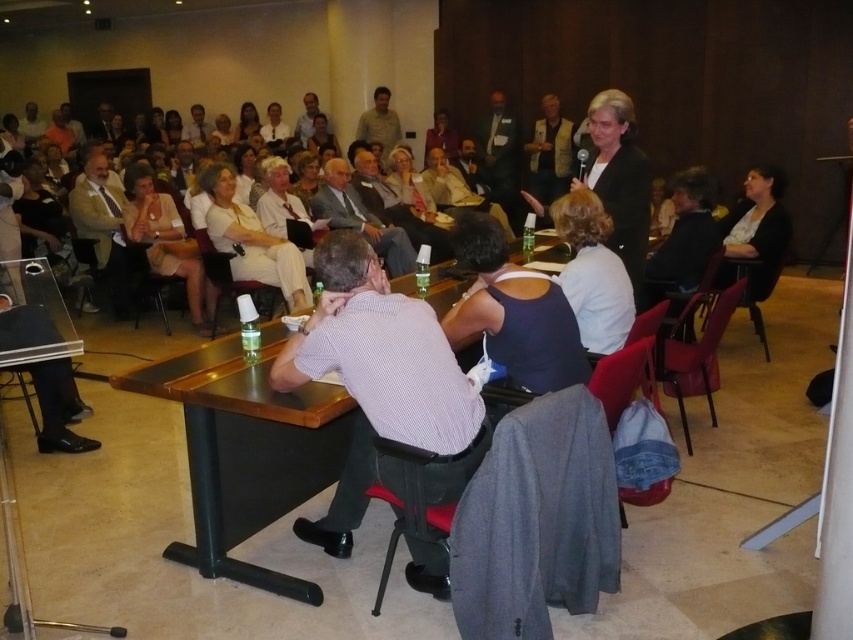
Which is more to the right, white striped shirt at center or dark blue tank top at center?

From the viewer's perspective, dark blue tank top at center appears more on the right side.

I want to click on white striped shirt at center, so click(x=381, y=385).

Locate an element on the screen. This screenshot has height=640, width=853. white striped shirt at center is located at coordinates (381, 385).

Does wooden table at center have a larger size compared to matte white blouse at center?

Correct, wooden table at center is larger in size than matte white blouse at center.

Does wooden table at center have a greater width compared to matte white blouse at center?

Yes.

Find the location of a particular element. wooden table at center is located at coordinates point(386,362).

You are a GUI agent. You are given a task and a screenshot of the screen. Output one action in this format:
    pyautogui.click(x=<x>, y=<y>)
    Task: Click on the wooden table at center
    The height and width of the screenshot is (640, 853).
    Given the screenshot: What is the action you would take?
    pyautogui.click(x=386, y=362)

Does dark blue tank top at center lie in front of white cotton dress at center?

Yes, it is in front of white cotton dress at center.

Is dark blue tank top at center bigger than white cotton dress at center?

No, dark blue tank top at center is not bigger than white cotton dress at center.

Is point (486, 275) farther from camera compared to point (260, 228)?

No, it is in front of (260, 228).

Identify the location of dark blue tank top at center. Image resolution: width=853 pixels, height=640 pixels. (514, 310).